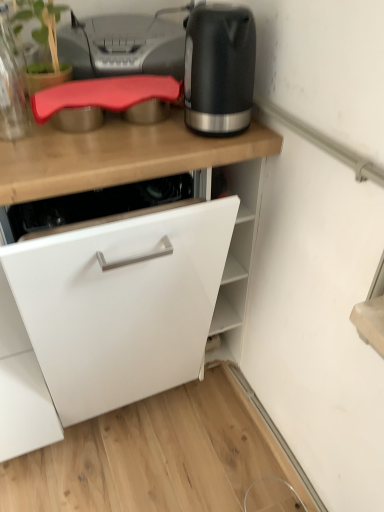
Question: From the image's perspective, is white matte cabinet at center located above or below matte black kettle at upper right?

Choices:
 (A) below
 (B) above

Answer: (A)

Question: Considering the positions of white matte cabinet at center and matte black kettle at upper right in the image, is white matte cabinet at center taller or shorter than matte black kettle at upper right?

Choices:
 (A) short
 (B) tall

Answer: (B)

Question: Which object is the farthest from the translucent glass jar at upper left?

Choices:
 (A) matte black kettle at upper right
 (B) matte gray printer at upper center
 (C) white matte cabinet at center

Answer: (A)

Question: Based on their relative distances, which object is nearer to the matte black kettle at upper right?

Choices:
 (A) translucent glass jar at upper left
 (B) matte gray printer at upper center
 (C) white matte cabinet at center

Answer: (C)